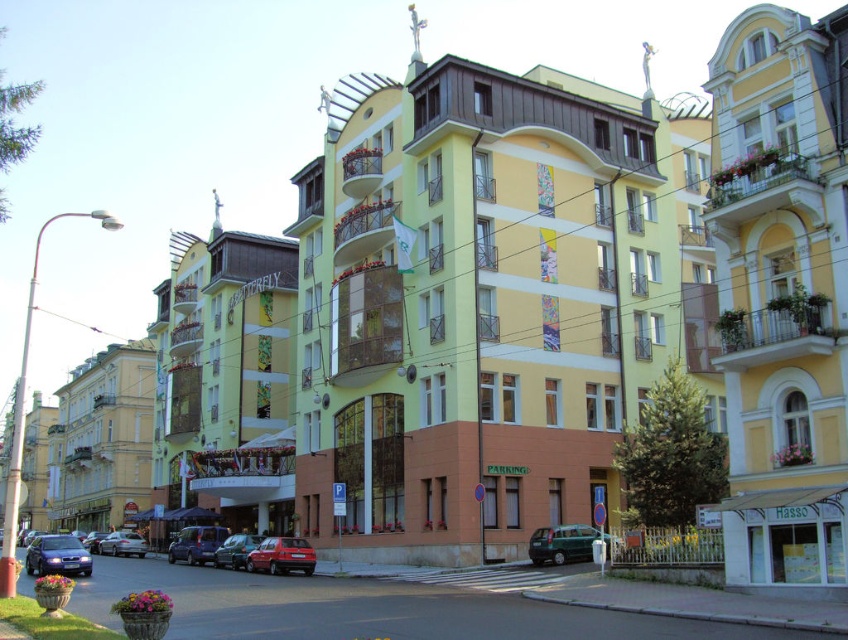
Where is `beige stone building at left`? Image resolution: width=848 pixels, height=640 pixels. beige stone building at left is located at coordinates (102, 440).

This screenshot has height=640, width=848. Describe the element at coordinates (102, 440) in the screenshot. I see `beige stone building at left` at that location.

Is point (151, 433) positioned before point (31, 566)?

No.

The height and width of the screenshot is (640, 848). Find the location of `beige stone building at left`. beige stone building at left is located at coordinates (102, 440).

Who is more distant from viewer, (590, 552) or (190, 550)?

The point (190, 550) is more distant.

Between metallic green van at center and metallic silver car at lower left, which one is positioned higher?

metallic green van at center is higher up.

Is point (534, 564) positioned after point (197, 536)?

No, it is in front of (197, 536).

Where is `metallic green van at center`? metallic green van at center is located at coordinates (561, 544).

Does point (589, 556) lie in front of point (51, 572)?

That is False.

Based on the photo, which is above, metallic green van at center or metallic blue sedan at lower left?

metallic green van at center

Measure the distance between metallic green van at center and camera.

213.99 feet

Locate an element on the screen. metallic green van at center is located at coordinates (561, 544).